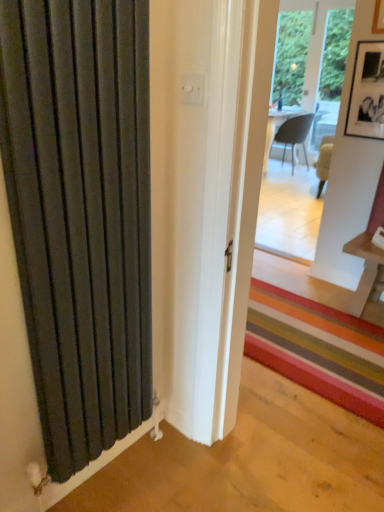
You are a GUI agent. You are given a task and a screenshot of the screen. Output one action in this format:
    pyautogui.click(x=<x>, y=<y>)
    Task: Click on the matte black radiator at left
    This screenshot has width=384, height=512.
    Given the screenshot: What is the action you would take?
    pyautogui.click(x=81, y=214)

Identify the location of matte black radiator at left. (81, 214).

From the image's perspective, is matte gray chair at center located beneath black matte picture frame at upper right?

Actually, matte gray chair at center appears above black matte picture frame at upper right in the image.

Is matte gray chair at center shorter than black matte picture frame at upper right?

Incorrect, the height of matte gray chair at center does not fall short of that of black matte picture frame at upper right.

From a real-world perspective, is matte gray chair at center under black matte picture frame at upper right?

Yes.

Which is more to the left, matte gray chair at center or black matte picture frame at upper right?

Positioned to the left is black matte picture frame at upper right.

Between black matte picture frame at upper right and matte gray chair at center, which one has larger width?

matte gray chair at center.

Considering their positions, is black matte picture frame at upper right located in front of or behind matte gray chair at center?

In the image, black matte picture frame at upper right appears in front of matte gray chair at center.

From a real-world perspective, which is physically below, black matte picture frame at upper right or matte gray chair at center?

In real-world perspective, matte gray chair at center is lower.

How much distance is there between black matte picture frame at upper right and matte gray chair at center?

black matte picture frame at upper right is 3.16 meters away from matte gray chair at center.

Consider the image. Can you confirm if matte gray chair at center is bigger than matte black radiator at left?

Yes, matte gray chair at center is bigger than matte black radiator at left.

From the image's perspective, is matte gray chair at center located above or below matte black radiator at left?

matte gray chair at center is situated higher than matte black radiator at left in the image.

Is matte gray chair at center to the right of matte black radiator at left from the viewer's perspective?

Yes.

Which of these two, matte gray chair at center or matte black radiator at left, is thinner?

matte black radiator at left.

Would you say matte black radiator at left contains black matte picture frame at upper right?

Definitely not — black matte picture frame at upper right is not inside matte black radiator at left.

From a real-world perspective, which object rests below the other?

matte black radiator at left, from a real-world perspective.

Can you confirm if matte black radiator at left is shorter than black matte picture frame at upper right?

Incorrect, the height of matte black radiator at left does not fall short of that of black matte picture frame at upper right.

Which of these two, matte black radiator at left or black matte picture frame at upper right, is smaller?

Smaller between the two is black matte picture frame at upper right.

How many degrees apart are the facing directions of black matte picture frame at upper right and matte black radiator at left?

89.7 degrees.

Consider the image. Is black matte picture frame at upper right facing away from matte black radiator at left?

No, black matte picture frame at upper right is not facing away from matte black radiator at left.

From a real-world perspective, is black matte picture frame at upper right on matte black radiator at left?

Correct, in the physical world, black matte picture frame at upper right is higher than matte black radiator at left.

Is black matte picture frame at upper right far away from matte black radiator at left?

That's right, there is a large distance between black matte picture frame at upper right and matte black radiator at left.

Is matte black radiator at left further to the viewer compared to matte gray chair at center?

No, matte black radiator at left is in front of matte gray chair at center.

Considering the sizes of objects matte black radiator at left and matte gray chair at center in the image provided, who is wider, matte black radiator at left or matte gray chair at center?

matte gray chair at center.

From the image's perspective, would you say matte black radiator at left is positioned over matte gray chair at center?

No, from the image's perspective, matte black radiator at left is not above matte gray chair at center.

Locate an element on the screen. picture frame that appears on the left of matte gray chair at center is located at coordinates (367, 92).

The width and height of the screenshot is (384, 512). Identify the location of chair above the black matte picture frame at upper right (from the image's perspective). (294, 134).

When comparing their distances from matte black radiator at left, does black matte picture frame at upper right or matte gray chair at center seem further?

The object further to matte black radiator at left is matte gray chair at center.

Considering their positions, is matte gray chair at center positioned further to black matte picture frame at upper right than matte black radiator at left?

matte gray chair at center.

Considering their positions, is matte black radiator at left positioned further to black matte picture frame at upper right than matte gray chair at center?

matte gray chair at center lies further to black matte picture frame at upper right than the other object.

Considering their positions, is matte gray chair at center positioned further to matte black radiator at left than black matte picture frame at upper right?

matte gray chair at center.

Considering their positions, is black matte picture frame at upper right positioned closer to matte gray chair at center than matte black radiator at left?

black matte picture frame at upper right is positioned closer to the anchor matte gray chair at center.

From the image, which object appears to be farther from matte gray chair at center, matte black radiator at left or black matte picture frame at upper right?

matte black radiator at left is positioned further to the anchor matte gray chair at center.

Locate an element on the screen. picture frame between matte black radiator at left and matte gray chair at center from front to back is located at coordinates (367, 92).